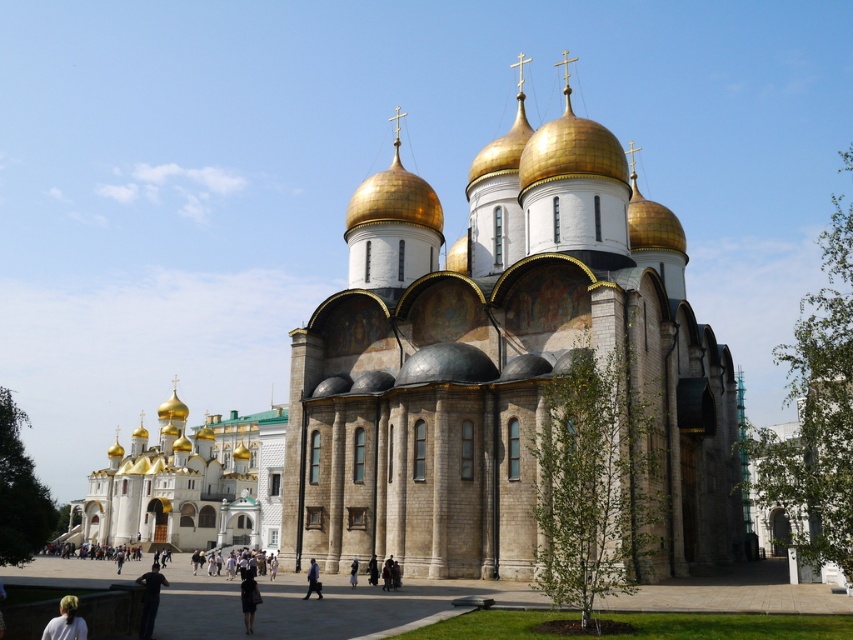
You are standing in a park and see the gold domed church at left. If you want to take a photo of it, where should you position yourself relative to the church?

You should position yourself to the right of the gold domed church at left since it is located at point (189, 483), which places it on the left side of the scene.